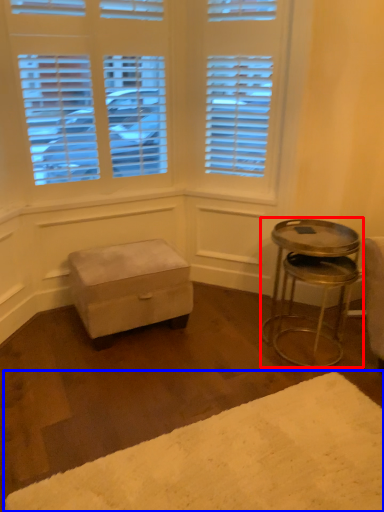
Question: Which of the following is the closest to the observer, table (highlighted by a red box) or plain (highlighted by a blue box)?

Choices:
 (A) table
 (B) plain

Answer: (B)